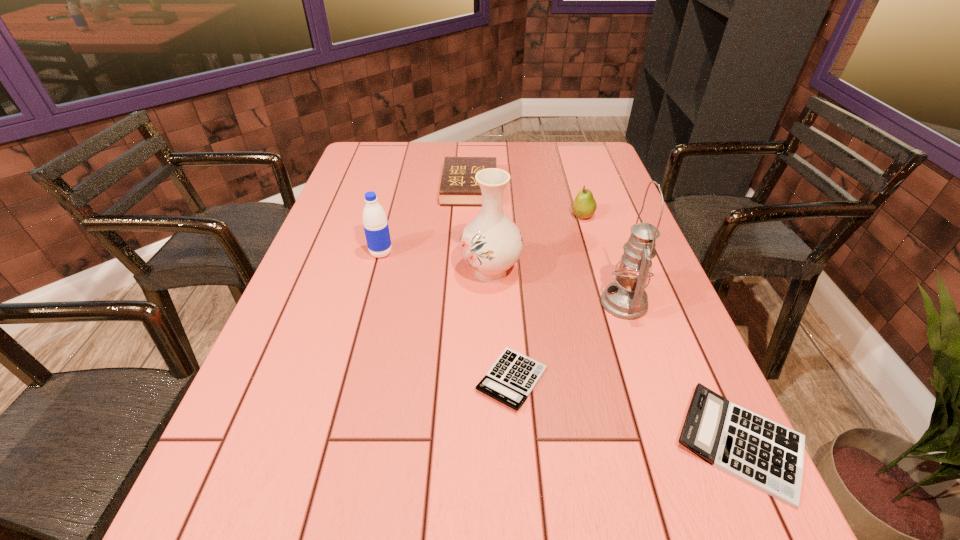
Image resolution: width=960 pixels, height=540 pixels. What are the coordinates of `object that is at the near edge` in the screenshot? It's located at (769, 456).

At what (x,y) coordinates should I click in order to perform the action: click on object that is at the left edge. Please return your answer as a coordinate pair (x, y). The image size is (960, 540). Looking at the image, I should click on (375, 223).

Find the location of a particular element. This screenshot has width=960, height=540. calculator at the right edge is located at coordinates (769, 456).

The height and width of the screenshot is (540, 960). In order to click on pear that is positioned at the right edge in this screenshot , I will do pyautogui.click(x=584, y=205).

Where is `oil lamp present at the right edge`? oil lamp present at the right edge is located at coordinates (625, 298).

You are a GUI agent. You are given a task and a screenshot of the screen. Output one action in this format:
    pyautogui.click(x=<x>, y=<y>)
    Task: Click on the object that is at the near right corner
    The width and height of the screenshot is (960, 540).
    Given the screenshot: What is the action you would take?
    pyautogui.click(x=769, y=456)

This screenshot has height=540, width=960. Identify the location of free space at the far edge. (400, 166).

Identify the location of vacant space at the near edge of the desktop. (425, 451).

In the image, there is a desktop. At what (x,y) coordinates should I click in order to perform the action: click on free space at the left edge. Please return your answer as a coordinate pair (x, y). The image size is (960, 540). Looking at the image, I should click on (353, 232).

Where is `free spot at the right edge of the desktop`? The image size is (960, 540). free spot at the right edge of the desktop is located at coordinates (653, 298).